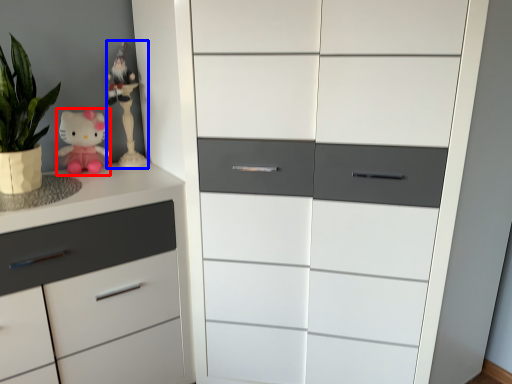
Question: Which of the following is the farthest to the observer, doll (highlighted by a red box) or miniature (highlighted by a blue box)?

Choices:
 (A) doll
 (B) miniature

Answer: (B)